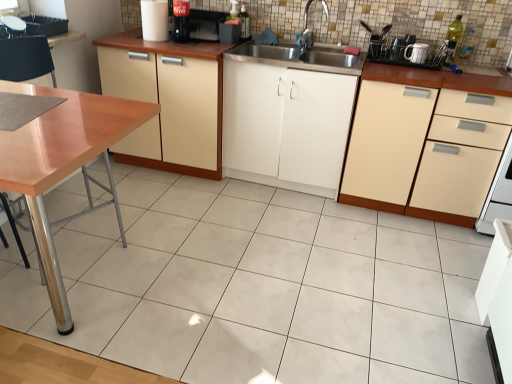
Identify the location of vacant space to the right of white glossy mug at upper right. (432, 66).